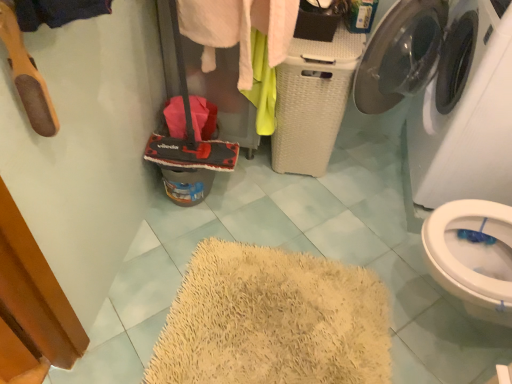
Describe the element at coordinates (189, 132) in the screenshot. I see `red fabric mop at center-left` at that location.

The image size is (512, 384). What do you see at coordinates (244, 43) in the screenshot? I see `soft pink towel at center` at bounding box center [244, 43].

The height and width of the screenshot is (384, 512). I want to click on red fabric mop at center-left, so click(x=189, y=132).

Which is farther from the camera, (174, 22) or (259, 72)?

The point (259, 72) is farther.

Does red fabric mop at center-left have a smaller size compared to soft pink towel at center?

Correct, red fabric mop at center-left occupies less space than soft pink towel at center.

From a real-world perspective, is red fabric mop at center-left located beneath soft pink towel at center?

No, from a real-world perspective, red fabric mop at center-left is not below soft pink towel at center.

Where is `clothing behind the red fabric mop at center-left`? clothing behind the red fabric mop at center-left is located at coordinates (244, 43).

What's the angular difference between white glossy washing machine at upper right and red fabric mop at center-left's facing directions?

white glossy washing machine at upper right and red fabric mop at center-left are facing 92.5 degrees away from each other.

In the image, is white glossy washing machine at upper right positioned in front of or behind red fabric mop at center-left?

Visually, white glossy washing machine at upper right is located in front of red fabric mop at center-left.

Would you say red fabric mop at center-left is part of white glossy washing machine at upper right's contents?

Actually, red fabric mop at center-left is outside white glossy washing machine at upper right.

Which is more to the left, white glossy washing machine at upper right or red fabric mop at center-left?

red fabric mop at center-left is more to the left.

From the image's perspective, is white glossy washing machine at upper right under soft pink towel at center?

Indeed, from the image's perspective, white glossy washing machine at upper right is shown beneath soft pink towel at center.

Is white glossy washing machine at upper right smaller than soft pink towel at center?

Actually, white glossy washing machine at upper right might be larger than soft pink towel at center.

Which of these two, white glossy washing machine at upper right or soft pink towel at center, is wider?

With larger width is white glossy washing machine at upper right.

Is white glossy washing machine at upper right not near soft pink towel at center?

No, white glossy washing machine at upper right is in close proximity to soft pink towel at center.

Consider the image. From a real-world perspective, between soft pink towel at center and white glossy washing machine at upper right, who is vertically lower?

In real-world perspective, soft pink towel at center is lower.

In terms of width, does soft pink towel at center look wider or thinner when compared to white glossy washing machine at upper right?

Considering their sizes, soft pink towel at center looks slimmer than white glossy washing machine at upper right.

From the image's perspective, who appears lower, soft pink towel at center or white glossy washing machine at upper right?

white glossy washing machine at upper right.

Which of these two, soft pink towel at center or white glossy washing machine at upper right, is smaller?

soft pink towel at center is smaller.

Is soft pink towel at center positioned far away from red fabric mop at center-left?

No, soft pink towel at center is not far from red fabric mop at center-left.

Considering the sizes of objects soft pink towel at center and red fabric mop at center-left in the image provided, who is wider, soft pink towel at center or red fabric mop at center-left?

soft pink towel at center is wider.

From a real-world perspective, which object rests below the other?

From a 3D spatial view, soft pink towel at center is below.

Considering the positions of objects soft pink towel at center and red fabric mop at center-left in the image provided, who is behind, soft pink towel at center or red fabric mop at center-left?

soft pink towel at center is further from the camera.

Could you tell me if red fabric mop at center-left is facing white glossy washing machine at upper right?

No, red fabric mop at center-left is not turned towards white glossy washing machine at upper right.

Where is `washing machine below the red fabric mop at center-left (from a real-world perspective)`? The image size is (512, 384). washing machine below the red fabric mop at center-left (from a real-world perspective) is located at coordinates (446, 94).

Consider the image. In the image, is red fabric mop at center-left on the left side or the right side of white glossy washing machine at upper right?

red fabric mop at center-left is to the left of white glossy washing machine at upper right.

Measure the distance from red fabric mop at center-left to white glossy washing machine at upper right.

red fabric mop at center-left and white glossy washing machine at upper right are 30.76 inches apart from each other.

The height and width of the screenshot is (384, 512). I want to click on luggage below the soft pink towel at center (from the image's perspective), so click(x=189, y=132).

Locate an element on the screen. Image resolution: width=512 pixels, height=384 pixels. luggage above the white glossy washing machine at upper right (from the image's perspective) is located at coordinates (189, 132).

Looking at the image, which one is located further to white glossy washing machine at upper right, soft pink towel at center or red fabric mop at center-left?

red fabric mop at center-left lies further to white glossy washing machine at upper right than the other object.

From the image, which object appears to be farther from soft pink towel at center, white glossy washing machine at upper right or red fabric mop at center-left?

white glossy washing machine at upper right is positioned further to the anchor soft pink towel at center.

When comparing their distances from soft pink towel at center, does red fabric mop at center-left or white glossy washing machine at upper right seem further?

white glossy washing machine at upper right lies further to soft pink towel at center than the other object.

Based on their spatial positions, is red fabric mop at center-left or soft pink towel at center further from white glossy washing machine at upper right?

Result: red fabric mop at center-left lies further to white glossy washing machine at upper right than the other object.

From the image, which object appears to be farther from red fabric mop at center-left, white glossy washing machine at upper right or soft pink towel at center?

Based on the image, white glossy washing machine at upper right appears to be further to red fabric mop at center-left.

Consider the image. Based on their spatial positions, is soft pink towel at center or white glossy washing machine at upper right closer to red fabric mop at center-left?

The object closer to red fabric mop at center-left is soft pink towel at center.

This screenshot has height=384, width=512. Identify the location of clothing located between red fabric mop at center-left and white glossy washing machine at upper right in the left-right direction. (244, 43).